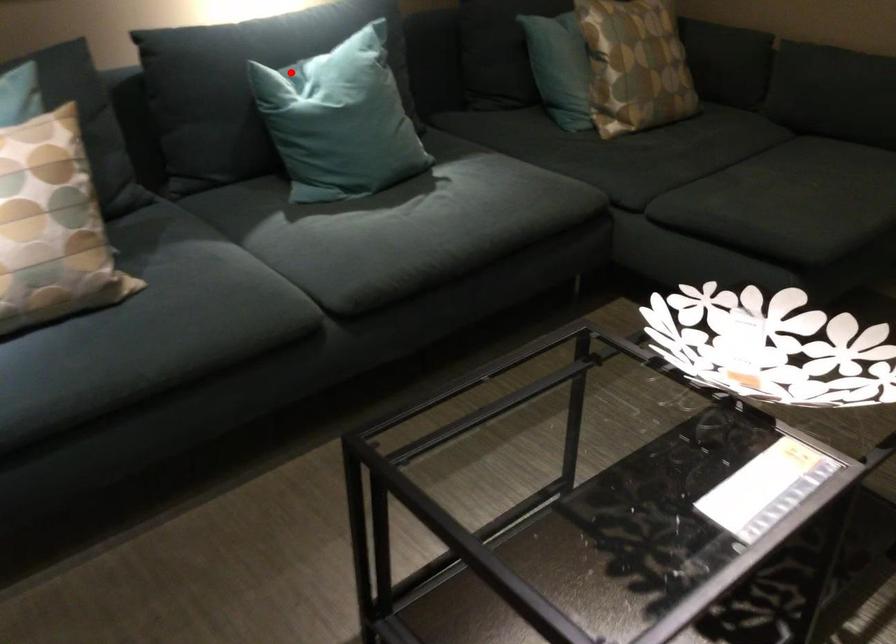
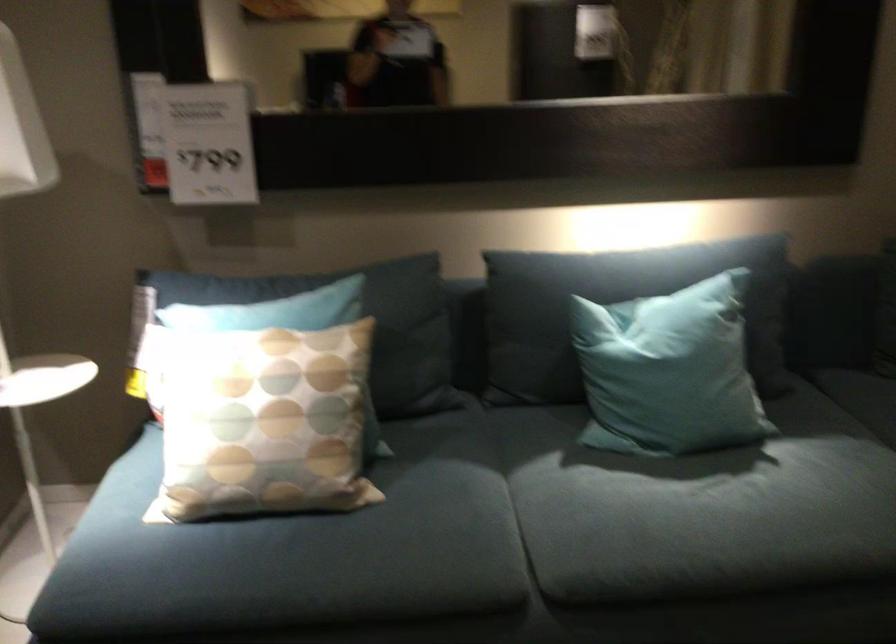
Find the pixel in the second image that matches the highlighted location in the first image.

(616, 308)